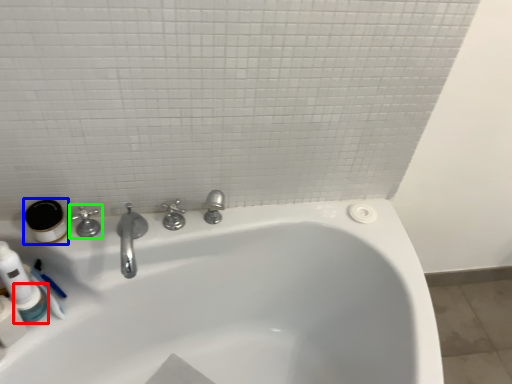
Question: Based on their relative distances, which object is farther from mouthwash (highlighted by a red box)? Choose from mouthwash (highlighted by a blue box) and tap (highlighted by a green box).

Choices:
 (A) mouthwash
 (B) tap

Answer: (B)